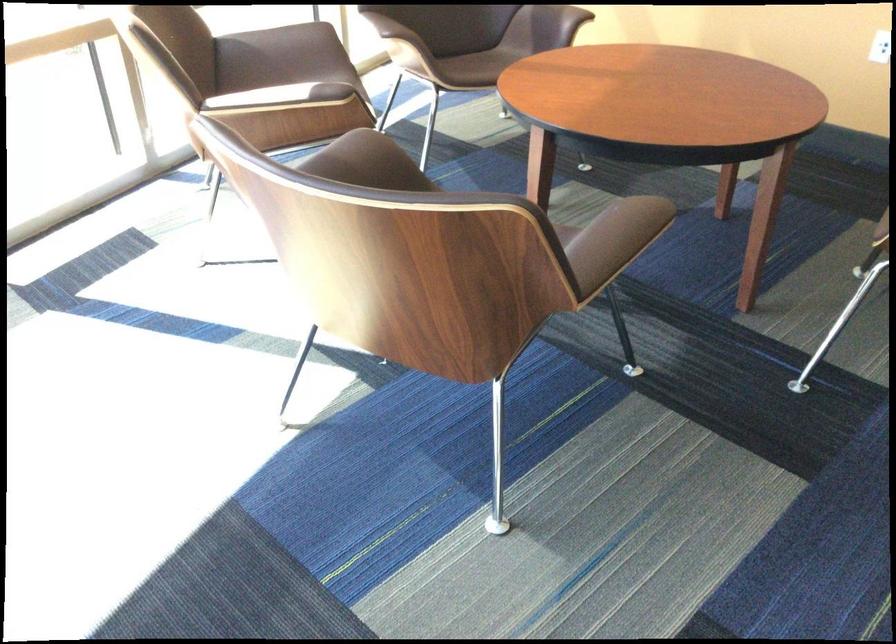
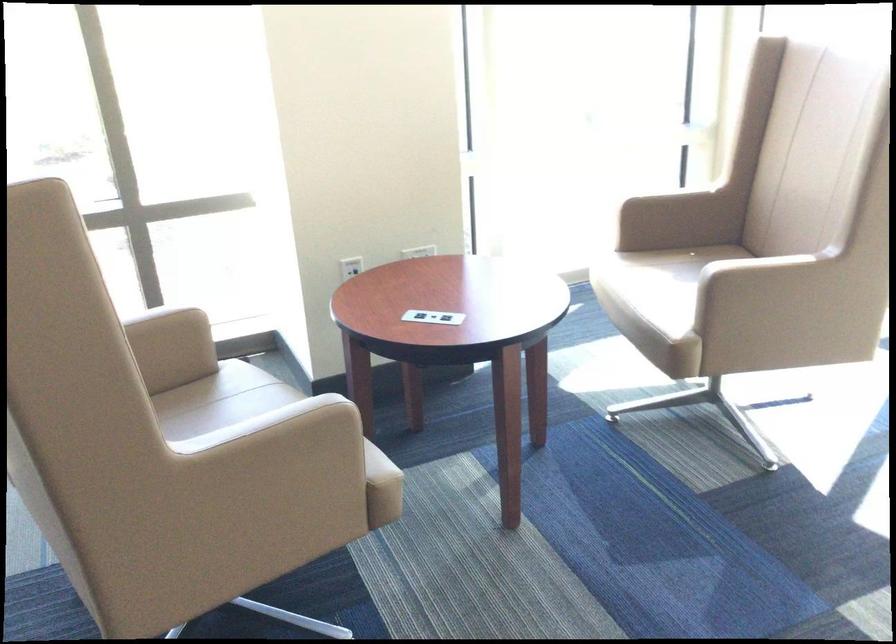
First-person continuous shooting, in which direction is the camera rotating?

The camera rotated toward left-down.